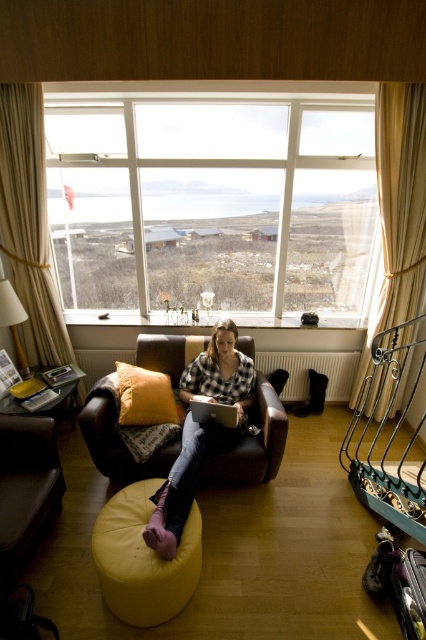
Question: Which is nearer to the yellow fabric ottoman at lower center?

Choices:
 (A) silver metallic laptop at center
 (B) velvet orange pillow at center

Answer: (B)

Question: Which of the following is the farthest from the observer?

Choices:
 (A) (161, 400)
 (B) (178, 611)
 (C) (161, 547)

Answer: (A)

Question: Is checkered fabric shirt at center to the left of silver metallic laptop at center from the viewer's perspective?

Choices:
 (A) no
 (B) yes

Answer: (B)

Question: Which point is closer to the camera?

Choices:
 (A) silver metallic laptop at center
 (B) velvet orange pillow at center

Answer: (A)

Question: Is white glass window at center to the right of checkered fabric shirt at center from the viewer's perspective?

Choices:
 (A) yes
 (B) no

Answer: (A)

Question: Observing the image, what is the correct spatial positioning of yellow fabric ottoman at lower center in reference to silver metallic laptop at center?

Choices:
 (A) left
 (B) right

Answer: (A)